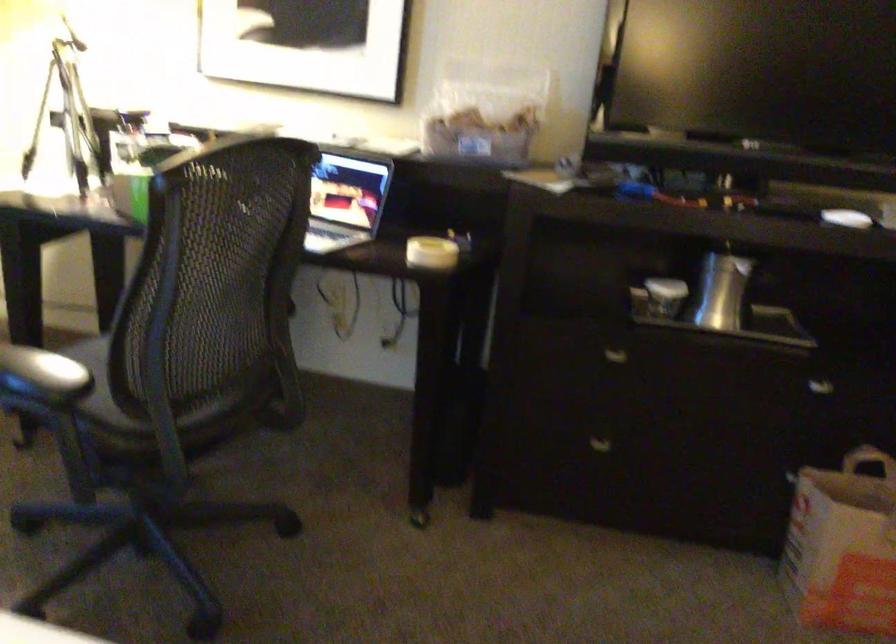
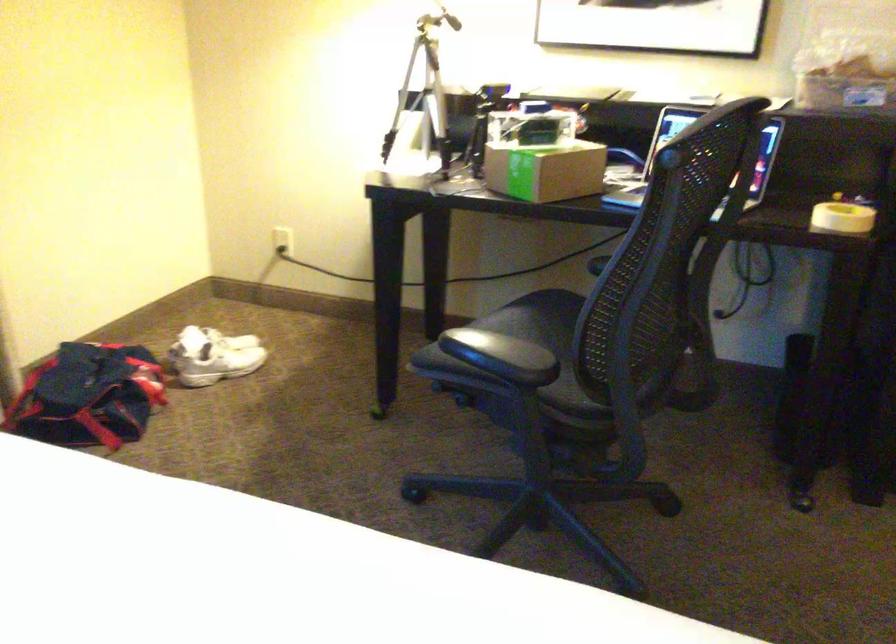
Question: The images are taken continuously from a first-person perspective. In which direction are you moving?

Choices:
 (A) Left
 (B) Right
 (C) Forward
 (D) Backward

Answer: (A)